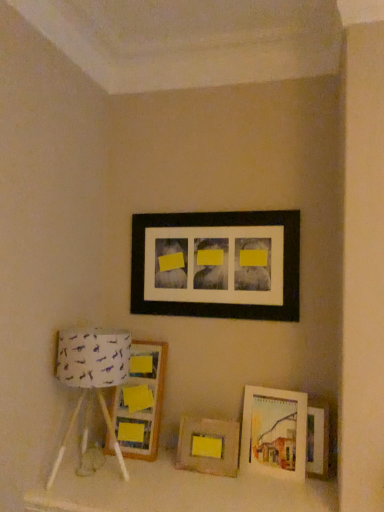
Question: Considering the relative positions of black matte picture frame at upper center, arranged as the fifth picture frame when ordered from the bottom, and wooden picture frame at left, which appears as the 4th picture frame when ordered from the bottom, in the image provided, is black matte picture frame at upper center, arranged as the fifth picture frame when ordered from the bottom, to the right of wooden picture frame at left, which appears as the 4th picture frame when ordered from the bottom, from the viewer's perspective?

Choices:
 (A) no
 (B) yes

Answer: (B)

Question: Does black matte picture frame at upper center, the first picture frame in the top-to-bottom sequence, have a lesser width compared to wooden picture frame at left, which is the second picture frame in top-to-bottom order?

Choices:
 (A) yes
 (B) no

Answer: (A)

Question: From the image's perspective, is black matte picture frame at upper center, arranged as the fifth picture frame when ordered from the bottom, over wooden picture frame at left, which appears as the 4th picture frame when ordered from the bottom?

Choices:
 (A) yes
 (B) no

Answer: (A)

Question: Does black matte picture frame at upper center, the first picture frame in the top-to-bottom sequence, have a greater height compared to wooden picture frame at left, which is the second picture frame in top-to-bottom order?

Choices:
 (A) yes
 (B) no

Answer: (B)

Question: Is black matte picture frame at upper center, arranged as the fifth picture frame when ordered from the bottom, smaller than wooden picture frame at left, which is the second picture frame in top-to-bottom order?

Choices:
 (A) no
 (B) yes

Answer: (B)

Question: Is black matte picture frame at upper center, arranged as the fifth picture frame when ordered from the bottom, facing towards wooden picture frame at left, which appears as the 4th picture frame when ordered from the bottom?

Choices:
 (A) yes
 (B) no

Answer: (B)

Question: Is wooden frame at center, arranged as the 5th picture frame when viewed from the top, at the right side of white fabric lampshade at left?

Choices:
 (A) yes
 (B) no

Answer: (A)

Question: Is wooden frame at center, arranged as the 5th picture frame when viewed from the top, thinner than white fabric lampshade at left?

Choices:
 (A) no
 (B) yes

Answer: (B)

Question: Is the position of wooden frame at center, which appears as the 1th picture frame when ordered from the bottom, less distant than that of white fabric lampshade at left?

Choices:
 (A) no
 (B) yes

Answer: (A)

Question: From a real-world perspective, does wooden frame at center, which appears as the 1th picture frame when ordered from the bottom, stand above white fabric lampshade at left?

Choices:
 (A) yes
 (B) no

Answer: (B)

Question: Can you confirm if wooden frame at center, which appears as the 1th picture frame when ordered from the bottom, is positioned to the left of white fabric lampshade at left?

Choices:
 (A) no
 (B) yes

Answer: (A)

Question: From the image's perspective, would you say wooden frame at center, which appears as the 1th picture frame when ordered from the bottom, is shown under white fabric lampshade at left?

Choices:
 (A) no
 (B) yes

Answer: (B)

Question: Is matte wooden picture frame at lower right, acting as the third picture frame starting from the bottom, taller than black matte picture frame at upper center, the first picture frame in the top-to-bottom sequence?

Choices:
 (A) yes
 (B) no

Answer: (B)